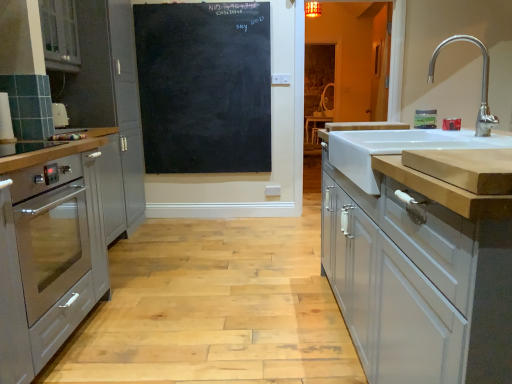
Question: Considering the relative sizes of stainless steel oven at left and white ceramic sink at right in the image provided, is stainless steel oven at left thinner than white ceramic sink at right?

Choices:
 (A) yes
 (B) no

Answer: (A)

Question: Is stainless steel oven at left not near white ceramic sink at right?

Choices:
 (A) yes
 (B) no

Answer: (A)

Question: Considering the relative positions of stainless steel oven at left and white ceramic sink at right in the image provided, is stainless steel oven at left to the left of white ceramic sink at right from the viewer's perspective?

Choices:
 (A) no
 (B) yes

Answer: (B)

Question: Considering the relative sizes of stainless steel oven at left and white ceramic sink at right in the image provided, is stainless steel oven at left taller than white ceramic sink at right?

Choices:
 (A) no
 (B) yes

Answer: (B)

Question: Is stainless steel oven at left wider than white ceramic sink at right?

Choices:
 (A) yes
 (B) no

Answer: (B)

Question: In terms of width, does green matte jar at upper right look wider or thinner when compared to white glossy cabinet at right, positioned as the fourth cabinetry in left-to-right order?

Choices:
 (A) thin
 (B) wide

Answer: (A)

Question: From a real-world perspective, is green matte jar at upper right positioned above or below white glossy cabinet at right, the 1th cabinetry viewed from the right?

Choices:
 (A) above
 (B) below

Answer: (A)

Question: Relative to white glossy cabinet at right, the 1th cabinetry viewed from the right, is green matte jar at upper right in front or behind?

Choices:
 (A) behind
 (B) front

Answer: (A)

Question: Is green matte jar at upper right situated inside white glossy cabinet at right, the 1th cabinetry viewed from the right, or outside?

Choices:
 (A) outside
 (B) inside

Answer: (A)

Question: Is black chalkboard at center inside or outside of white glossy cabinet at right, positioned as the fourth cabinetry in left-to-right order?

Choices:
 (A) outside
 (B) inside

Answer: (A)

Question: Is black chalkboard at center taller or shorter than white glossy cabinet at right, positioned as the fourth cabinetry in left-to-right order?

Choices:
 (A) short
 (B) tall

Answer: (B)

Question: In terms of width, does black chalkboard at center look wider or thinner when compared to white glossy cabinet at right, positioned as the fourth cabinetry in left-to-right order?

Choices:
 (A) wide
 (B) thin

Answer: (B)

Question: Would you say black chalkboard at center is to the left or to the right of white glossy cabinet at right, the 1th cabinetry viewed from the right, in the picture?

Choices:
 (A) right
 (B) left

Answer: (B)

Question: Is stainless steel oven at left inside or outside of satin silver oven at left, the second cabinetry in the left-to-right sequence?

Choices:
 (A) outside
 (B) inside

Answer: (A)

Question: From a real-world perspective, is stainless steel oven at left physically located above or below satin silver oven at left, the second cabinetry in the left-to-right sequence?

Choices:
 (A) below
 (B) above

Answer: (A)